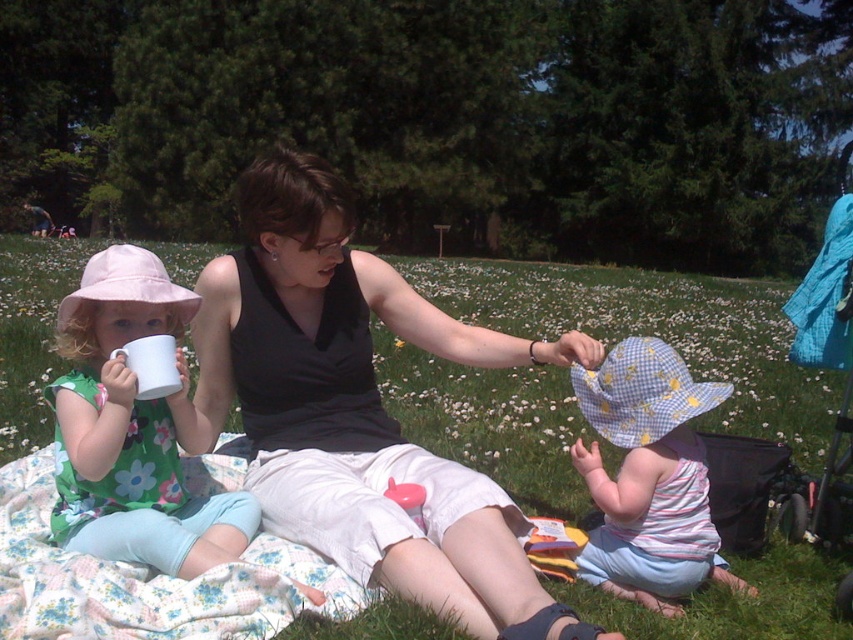
What do you see at coordinates (657, 332) in the screenshot?
I see `green grass at center` at bounding box center [657, 332].

Between point (6, 349) and point (843, 289), which one is positioned behind?

The point (6, 349) is more distant.

Image resolution: width=853 pixels, height=640 pixels. Identify the location of green grass at center. (657, 332).

Can you confirm if matte white cup at left is smaller than blue fabric stroller at right?

Yes.

Describe the element at coordinates (132, 429) in the screenshot. Image resolution: width=853 pixels, height=640 pixels. I see `matte white cup at left` at that location.

This screenshot has width=853, height=640. Describe the element at coordinates (132, 429) in the screenshot. I see `matte white cup at left` at that location.

In order to click on matte white cup at left in this screenshot , I will do pos(132,429).

Is green grass at center further to the viewer compared to checkered cotton hat at center?

No, it is in front of checkered cotton hat at center.

Between point (564, 477) and point (674, 557), which one is positioned in front?

Positioned in front is point (674, 557).

Locate an element on the screen. This screenshot has height=640, width=853. green grass at center is located at coordinates (657, 332).